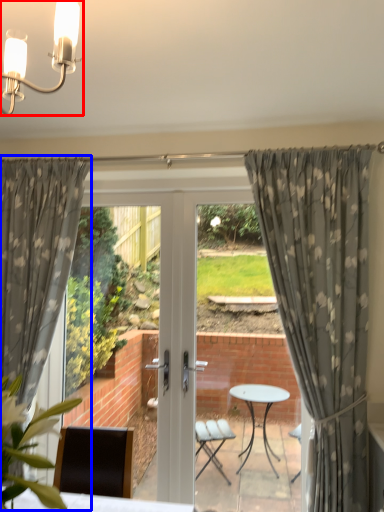
Question: Which of the following is the farthest to the observer, light fixture (highlighted by a red box) or curtain (highlighted by a blue box)?

Choices:
 (A) light fixture
 (B) curtain

Answer: (B)